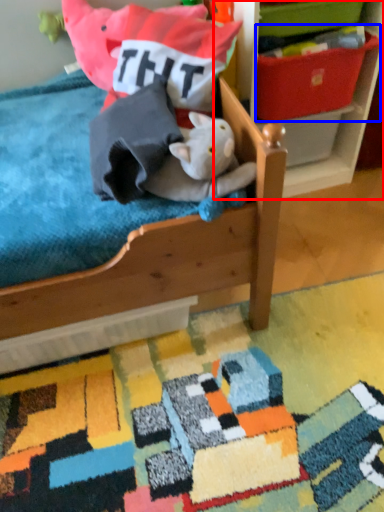
Question: Which of the following is the farthest to the observer, shelf (highlighted by a red box) or storage box (highlighted by a blue box)?

Choices:
 (A) shelf
 (B) storage box

Answer: (B)